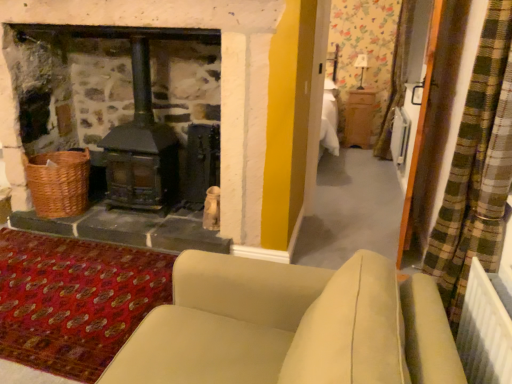
Question: Is black matte wood burning stove at left not within white plastic screen door at right?

Choices:
 (A) no
 (B) yes

Answer: (B)

Question: From the image's perspective, is black matte wood burning stove at left under white plastic screen door at right?

Choices:
 (A) no
 (B) yes

Answer: (A)

Question: From a real-world perspective, is black matte wood burning stove at left on white plastic screen door at right?

Choices:
 (A) yes
 (B) no

Answer: (B)

Question: Is black matte wood burning stove at left looking in the opposite direction of white plastic screen door at right?

Choices:
 (A) yes
 (B) no

Answer: (B)

Question: Does black matte wood burning stove at left turn towards white plastic screen door at right?

Choices:
 (A) yes
 (B) no

Answer: (B)

Question: From the image's perspective, relative to beige fabric couch at lower center, is black matte wood burning stove at left above or below?

Choices:
 (A) above
 (B) below

Answer: (A)

Question: Considering their positions, is black matte wood burning stove at left located in front of or behind beige fabric couch at lower center?

Choices:
 (A) behind
 (B) front

Answer: (A)

Question: Considering the relative positions of black matte wood burning stove at left and beige fabric couch at lower center in the image provided, is black matte wood burning stove at left to the left or to the right of beige fabric couch at lower center?

Choices:
 (A) left
 (B) right

Answer: (A)

Question: Would you say black matte wood burning stove at left is inside or outside beige fabric couch at lower center?

Choices:
 (A) outside
 (B) inside

Answer: (A)

Question: From a real-world perspective, is woven brown basket at lower left above or below black matte wood burning stove at left?

Choices:
 (A) below
 (B) above

Answer: (A)

Question: From their relative heights in the image, would you say woven brown basket at lower left is taller or shorter than black matte wood burning stove at left?

Choices:
 (A) tall
 (B) short

Answer: (B)

Question: Is woven brown basket at lower left bigger or smaller than black matte wood burning stove at left?

Choices:
 (A) big
 (B) small

Answer: (B)

Question: Would you say woven brown basket at lower left is to the left or to the right of black matte wood burning stove at left in the picture?

Choices:
 (A) left
 (B) right

Answer: (A)

Question: Does point (428, 299) appear closer or farther from the camera than point (69, 168)?

Choices:
 (A) farther
 (B) closer

Answer: (B)

Question: From the image's perspective, is beige fabric couch at lower center positioned above or below woven brown basket at lower left?

Choices:
 (A) above
 (B) below

Answer: (B)